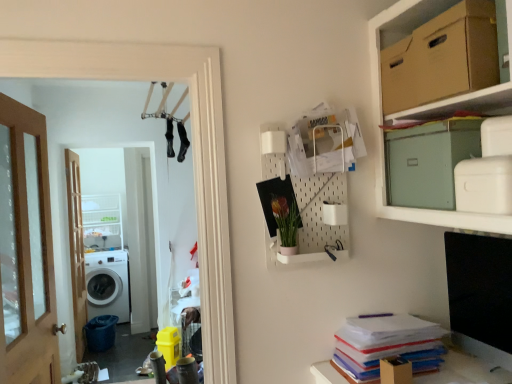
Question: Can you confirm if brown cardboard box at upper right, arranged as the 2th cardboard box when ordered from the bottom, is positioned to the left of white plastic cabinet at left?

Choices:
 (A) yes
 (B) no

Answer: (B)

Question: Can you confirm if brown cardboard box at upper right, positioned as the 1th cardboard box in top-to-bottom order, is bigger than white plastic cabinet at left?

Choices:
 (A) no
 (B) yes

Answer: (A)

Question: Can you see brown cardboard box at upper right, arranged as the 2th cardboard box when ordered from the bottom, touching white plastic cabinet at left?

Choices:
 (A) no
 (B) yes

Answer: (A)

Question: Is white plastic cabinet at left located within brown cardboard box at upper right, positioned as the 1th cardboard box in top-to-bottom order?

Choices:
 (A) no
 (B) yes

Answer: (A)

Question: From the image's perspective, is brown cardboard box at upper right, positioned as the 1th cardboard box in top-to-bottom order, located above white plastic cabinet at left?

Choices:
 (A) no
 (B) yes

Answer: (B)

Question: Can you confirm if brown cardboard box at upper right, arranged as the 2th cardboard box when ordered from the bottom, is positioned to the right of white plastic cabinet at left?

Choices:
 (A) yes
 (B) no

Answer: (A)

Question: Is white plastic cabinet at left next to matte green cardboard box at upper right, which is counted as the 1th cardboard box, starting from the bottom, and touching it?

Choices:
 (A) no
 (B) yes

Answer: (A)

Question: Is white plastic cabinet at left outside matte green cardboard box at upper right, which is counted as the 1th cardboard box, starting from the bottom?

Choices:
 (A) no
 (B) yes

Answer: (B)

Question: Does white plastic cabinet at left have a greater height compared to matte green cardboard box at upper right, which is the second cardboard box from top to bottom?

Choices:
 (A) no
 (B) yes

Answer: (B)

Question: Does white plastic cabinet at left have a greater width compared to matte green cardboard box at upper right, which is the second cardboard box from top to bottom?

Choices:
 (A) no
 (B) yes

Answer: (B)

Question: Is white plastic cabinet at left positioned before matte green cardboard box at upper right, which is the second cardboard box from top to bottom?

Choices:
 (A) no
 (B) yes

Answer: (A)

Question: Can matte green cardboard box at upper right, which is counted as the 1th cardboard box, starting from the bottom, be found inside white plastic cabinet at left?

Choices:
 (A) yes
 (B) no

Answer: (B)

Question: Is wooden door at left, the 2th door when ordered from left to right, far away from matte green cardboard box at upper right, which is the second cardboard box from top to bottom?

Choices:
 (A) no
 (B) yes

Answer: (B)